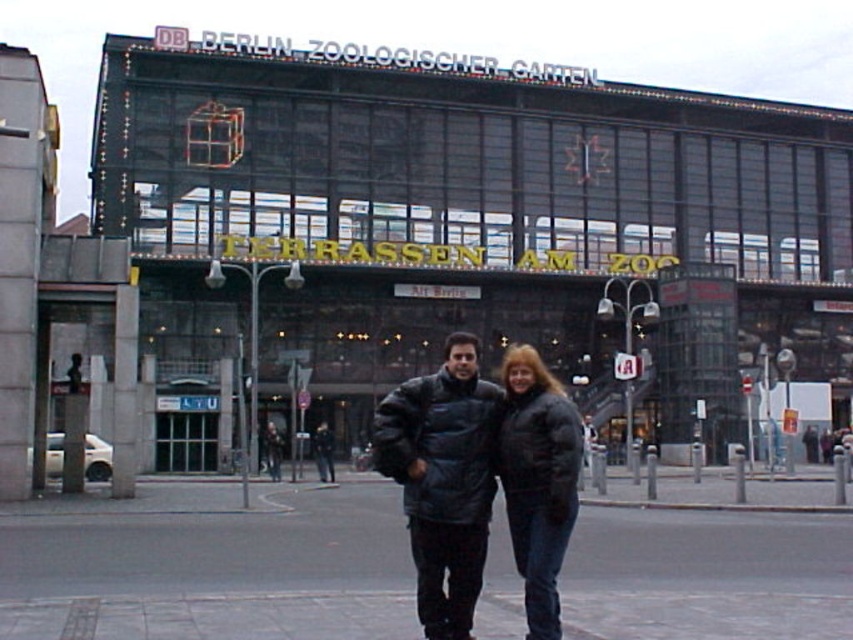
Question: Can you confirm if smooth concrete pavement at center is positioned above black puffy coat at center?

Choices:
 (A) yes
 (B) no

Answer: (B)

Question: Does black puffy jackets at center appear over black puffy coat at center?

Choices:
 (A) yes
 (B) no

Answer: (B)

Question: Does smooth concrete pavement at center have a greater width compared to black puffy coat at center?

Choices:
 (A) no
 (B) yes

Answer: (B)

Question: Which of the following is the closest to the observer?

Choices:
 (A) [x=538, y=476]
 (B) [x=694, y=612]

Answer: (A)

Question: Among these objects, which one is farthest from the camera?

Choices:
 (A) black puffy jackets at center
 (B) black puffy coat at center
 (C) smooth concrete pavement at center

Answer: (C)

Question: Which of the following is the farthest from the observer?

Choices:
 (A) (155, 593)
 (B) (575, 464)
 (C) (474, 560)

Answer: (A)